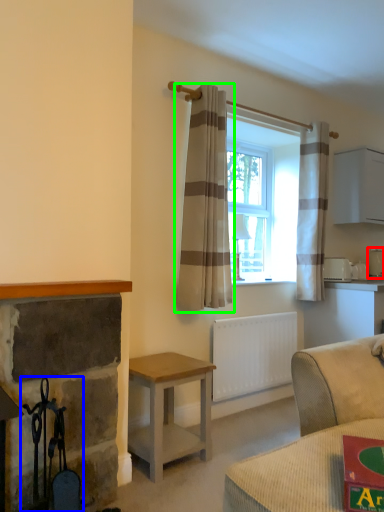
Question: Estimate the real-world distances between objects in this image. Which object is closer to appliance (highlighted by a red box), chair (highlighted by a blue box) or curtain (highlighted by a green box)?

Choices:
 (A) chair
 (B) curtain

Answer: (B)